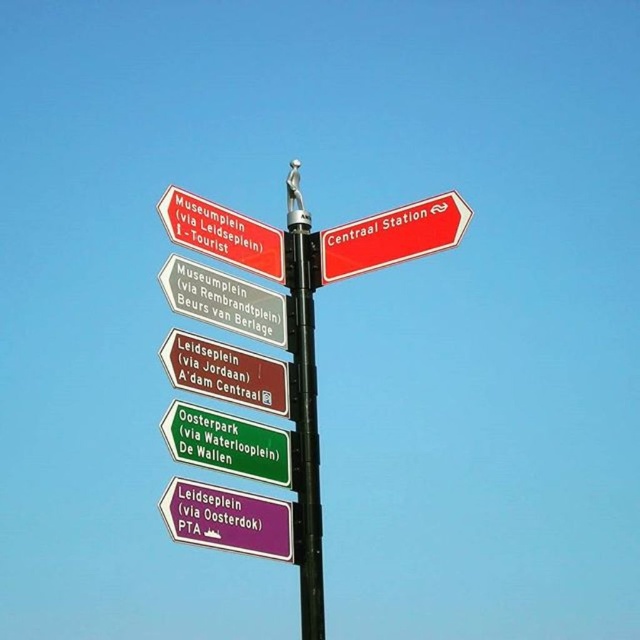
You are standing in a square and need to reach the nearest tourist information center. You see a black metal pole at center and a green matte signpost at lower center. Which object should you approach first to get directions?

You should approach the green matte signpost at lower center first since it is closer to you than the black metal pole at center, which is much taller and likely farther away.

What is located at the coordinates point (x=305, y=403)?

The black metal pole at center is located at point (x=305, y=403).

You are standing at the coordinates given in the scene description. Can you see the black metal pole at center from your current position?

Yes, since the black metal pole at center is located at your current coordinates, you are standing directly at its position and can see it clearly.